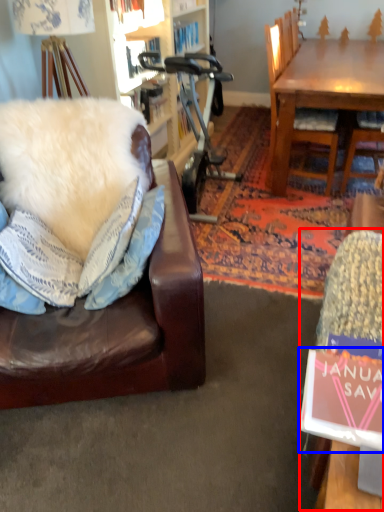
Question: Which object appears farthest to the camera in this image, swivel chair (highlighted by a red box) or book (highlighted by a blue box)?

Choices:
 (A) swivel chair
 (B) book

Answer: (A)